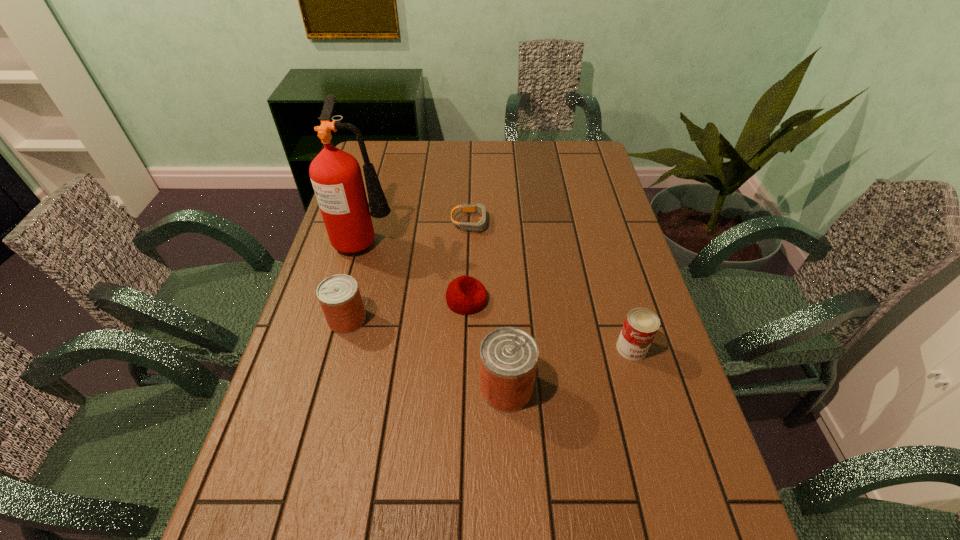
Find the location of `the farthest can`. the farthest can is located at coordinates (339, 296).

Find the location of a particular element. the nearest object is located at coordinates (508, 356).

Where is `the second can from left to right`? the second can from left to right is located at coordinates (508, 356).

At what (x,y) coordinates should I click in order to perform the action: click on goggles. Please return your answer as a coordinate pair (x, y). Image resolution: width=960 pixels, height=540 pixels. Looking at the image, I should click on (480, 226).

You are a GUI agent. You are given a task and a screenshot of the screen. Output one action in this format:
    pyautogui.click(x=<x>, y=<y>)
    Task: Click on the fire extinguisher
    This screenshot has width=960, height=540.
    Given the screenshot: What is the action you would take?
    pyautogui.click(x=336, y=176)

Find the location of a particular element. The image size is (960, 540). the rightmost object is located at coordinates (641, 324).

The image size is (960, 540). I want to click on the second nearest can, so click(641, 324).

This screenshot has width=960, height=540. I want to click on beanbag, so click(465, 295).

The width and height of the screenshot is (960, 540). I want to click on vacant area located 0.330m on the front of the leftmost can, so click(308, 468).

Identify the location of free spot located 0.200m on the left of the nearest object. This screenshot has height=540, width=960. (393, 388).